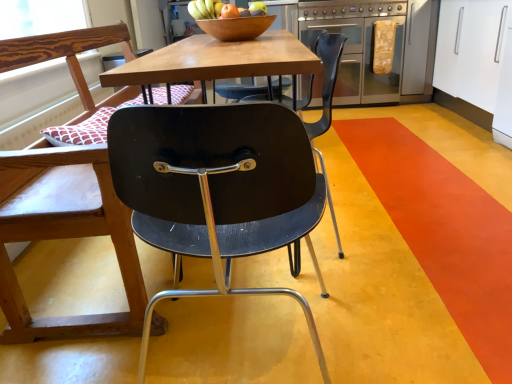
Identify the location of vacant point to the right of matte black chair at left, which is counted as the 2th chair, starting from the right. (391, 213).